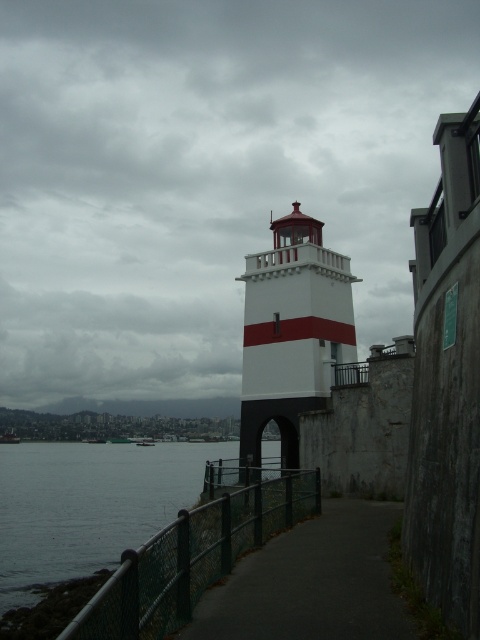
Question: Estimate the real-world distances between objects in this image. Which object is farther from the dark gray asphalt at center?

Choices:
 (A) white painted concrete lighthouse at center
 (B) green chain-link fence at lower center

Answer: (A)

Question: Which point is closer to the camera taking this photo?

Choices:
 (A) (276, 596)
 (B) (302, 228)

Answer: (A)

Question: In this image, where is dark gray asphalt at center located relative to green chain-link fence at lower center?

Choices:
 (A) left
 (B) right

Answer: (B)

Question: Is white painted concrete lighthouse at center further to camera compared to green chain-link fence at lower center?

Choices:
 (A) yes
 (B) no

Answer: (A)

Question: Is dark gray asphalt at center below green chain-link fence at lower center?

Choices:
 (A) yes
 (B) no

Answer: (B)

Question: Which point appears farthest from the camera in this image?

Choices:
 (A) (166, 557)
 (B) (315, 356)
 (C) (383, 634)

Answer: (B)